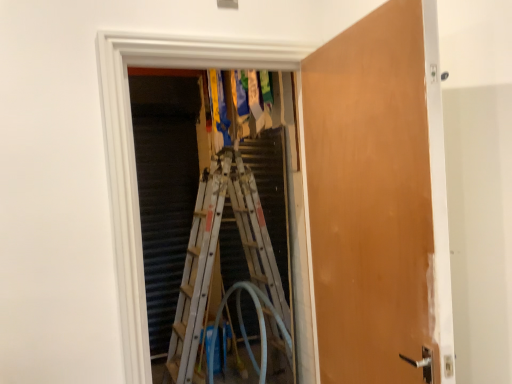
Question: From the image's perspective, is translucent rubber garden hose at center under wooden door at center?

Choices:
 (A) no
 (B) yes

Answer: (B)

Question: Can you confirm if translucent rubber garden hose at center is smaller than wooden door at center?

Choices:
 (A) no
 (B) yes

Answer: (A)

Question: Considering the relative sizes of translucent rubber garden hose at center and wooden door at center in the image provided, is translucent rubber garden hose at center bigger than wooden door at center?

Choices:
 (A) no
 (B) yes

Answer: (B)

Question: Considering the relative sizes of translucent rubber garden hose at center and wooden door at center in the image provided, is translucent rubber garden hose at center shorter than wooden door at center?

Choices:
 (A) no
 (B) yes

Answer: (B)

Question: From a real-world perspective, is translucent rubber garden hose at center under wooden door at center?

Choices:
 (A) yes
 (B) no

Answer: (A)

Question: In terms of width, does white metallic ladder at center look wider or thinner when compared to translucent rubber garden hose at center?

Choices:
 (A) wide
 (B) thin

Answer: (B)

Question: From a real-world perspective, is white metallic ladder at center physically located above or below translucent rubber garden hose at center?

Choices:
 (A) below
 (B) above

Answer: (B)

Question: Is white metallic ladder at center to the left or to the right of translucent rubber garden hose at center in the image?

Choices:
 (A) left
 (B) right

Answer: (B)

Question: Considering the positions of white metallic ladder at center and translucent rubber garden hose at center in the image, is white metallic ladder at center bigger or smaller than translucent rubber garden hose at center?

Choices:
 (A) small
 (B) big

Answer: (A)

Question: In terms of width, does white metallic ladder at center look wider or thinner when compared to wooden door at center?

Choices:
 (A) thin
 (B) wide

Answer: (A)

Question: Does point (173, 326) appear closer or farther from the camera than point (421, 54)?

Choices:
 (A) closer
 (B) farther

Answer: (B)

Question: Visually, is white metallic ladder at center positioned to the left or to the right of wooden door at center?

Choices:
 (A) left
 (B) right

Answer: (A)

Question: From the image's perspective, is white metallic ladder at center above or below wooden door at center?

Choices:
 (A) above
 (B) below

Answer: (B)

Question: Is translucent rubber garden hose at center in front of or behind wooden door at center in the image?

Choices:
 (A) behind
 (B) front

Answer: (A)

Question: In the image, is translucent rubber garden hose at center on the left side or the right side of wooden door at center?

Choices:
 (A) right
 (B) left

Answer: (B)